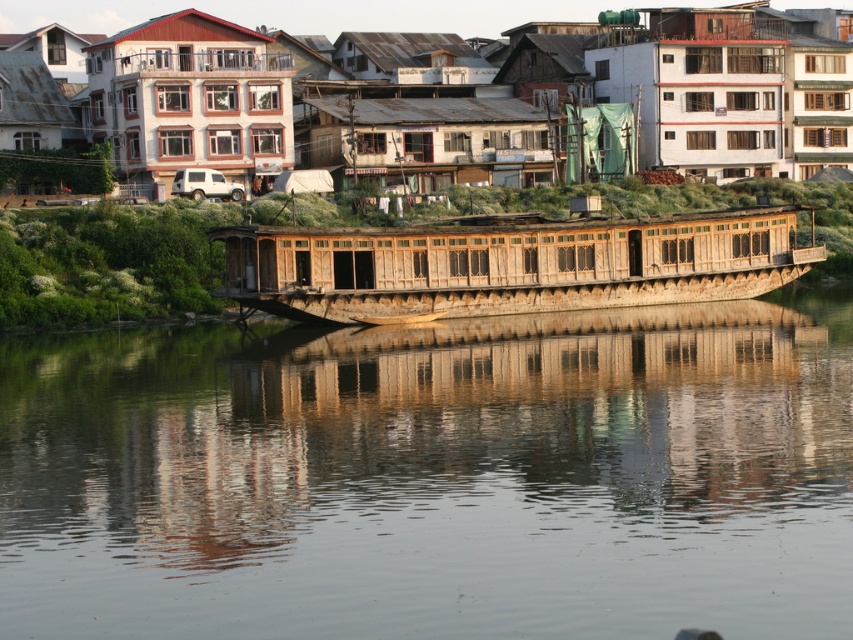
You are standing on the traditional wooden houseboat and want to locate the point at coordinates point (434, 477). According to the scene description, where would you find this point?

The point (434, 477) is located on the smooth brown water at center.